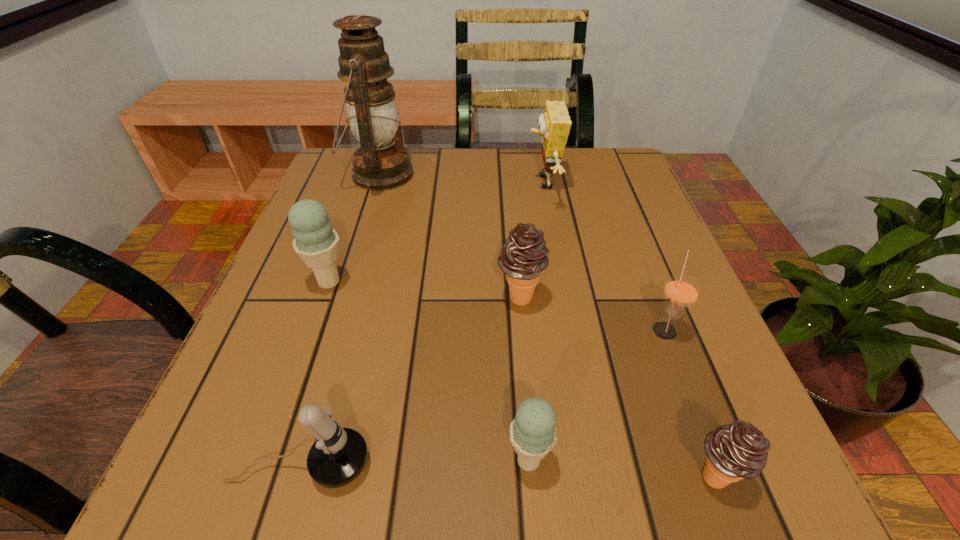
The width and height of the screenshot is (960, 540). In order to click on the rightmost icecream in this screenshot , I will do `click(736, 451)`.

Find the location of a particular element. the nearer chocolate icecream is located at coordinates (736, 451).

Identify the location of vacant space situated on the right of the tallest object. The image size is (960, 540). click(x=540, y=174).

I want to click on vacant point located on the face of the yellow sponge, so click(x=405, y=183).

Find the location of a particular element. The height and width of the screenshot is (540, 960). free space located on the face of the yellow sponge is located at coordinates (466, 183).

At what (x,y) coordinates should I click in order to perform the action: click on free point located 0.230m on the face of the yellow sponge. Please return your answer as a coordinate pair (x, y). This screenshot has height=540, width=960. Looking at the image, I should click on (427, 183).

Find the location of a particular element. The width and height of the screenshot is (960, 540). vacant space located on the back of the bigger blue ice cream is located at coordinates (352, 216).

The image size is (960, 540). Identify the location of blank area located on the right of the bigger chocolate icecream. (619, 298).

Identify the location of free point located 0.160m on the front of the straw. The height and width of the screenshot is (540, 960). (707, 441).

Where is `vacant space located 0.390m on the right of the microphone`? vacant space located 0.390m on the right of the microphone is located at coordinates pos(682,465).